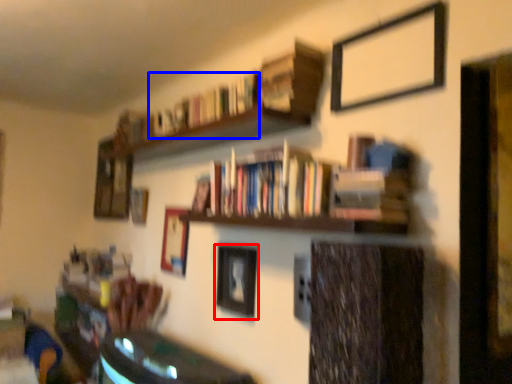
Question: Which object appears farthest to the camera in this image, picture frame (highlighted by a red box) or book (highlighted by a blue box)?

Choices:
 (A) picture frame
 (B) book

Answer: (A)